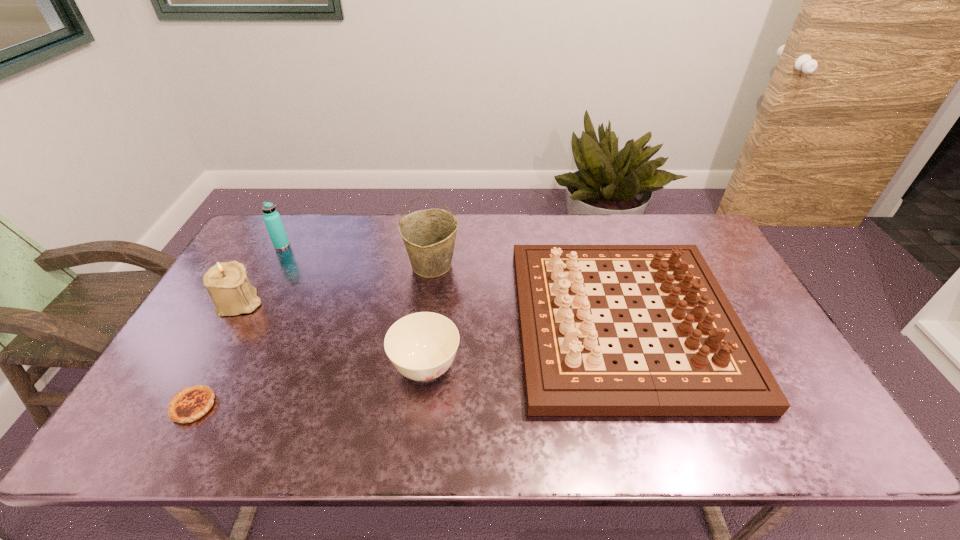
Locate an element on the screen. vacant area at the left edge is located at coordinates (166, 373).

You are a GUI agent. You are given a task and a screenshot of the screen. Output one action in this format:
    pyautogui.click(x=<x>, y=<y>)
    Task: Click on the vacant space at the right edge
    The height and width of the screenshot is (540, 960).
    Given the screenshot: What is the action you would take?
    pyautogui.click(x=732, y=303)

Image resolution: width=960 pixels, height=540 pixels. What are the coordinates of `vacant area at the far left corner` in the screenshot? It's located at (288, 214).

In the image, there is a desktop. In order to click on free region at the far right corner in this screenshot , I will do `click(696, 241)`.

Find the location of a particular element. vacant area that lies between the fifth tallest object and the quiche is located at coordinates (309, 387).

Locate an element on the screen. free space between the second shortest object and the water bottle is located at coordinates click(x=354, y=307).

Find the location of a particular element. The width and height of the screenshot is (960, 540). unoccupied area between the water bottle and the gameboard is located at coordinates 453,284.

Find the location of a particular element. Image resolution: width=960 pixels, height=540 pixels. vacant space in between the candle_holder and the tallest object is located at coordinates click(336, 284).

You are a GUI agent. You are given a task and a screenshot of the screen. Output one action in this format:
    pyautogui.click(x=<x>, y=<y>)
    Task: Click on the vacant area that lies between the shortest object and the sugar bowl
    The width and height of the screenshot is (960, 540).
    Given the screenshot: What is the action you would take?
    pyautogui.click(x=309, y=387)

This screenshot has width=960, height=540. I want to click on unoccupied area between the sugar bowl and the shortest object, so click(309, 387).